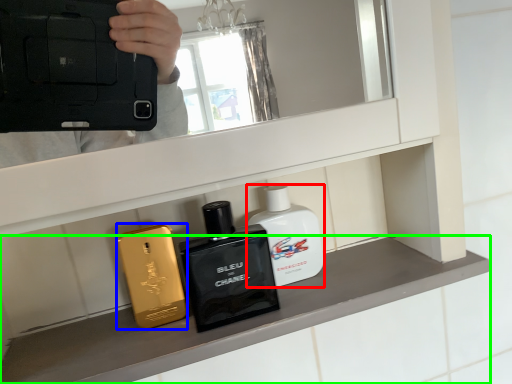
Question: Which is nearer to the perfume (highlighted by a red box)? perfume (highlighted by a blue box) or mantle (highlighted by a green box).

Choices:
 (A) perfume
 (B) mantle

Answer: (B)